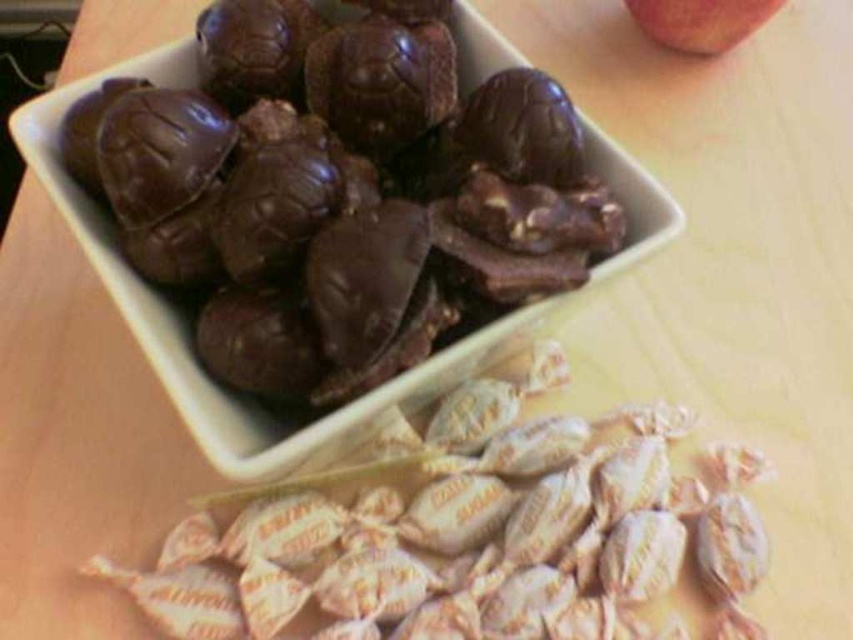
You are looking at the arrangement of candies and chocolate in the image. If you were to draw a straight line from your eye level to the point labeled point (527, 284) and then to the point labeled point (308, 531), which point would you encounter first?

You would encounter point (527, 284) first since it is closer to the viewer than point (308, 531).

You are a customer at a candy store and want to grab both the shiny chocolate candies at upper center and the white paper wrapped candy at lower center. Which one should you pick up first if you want to reach the one closer to your right hand?

The white paper wrapped candy at lower center is on the right side of the shiny chocolate candies at upper center, so you should pick up the white paper wrapped candy at lower center first if you want to reach the one closer to your right hand.

You are a food critic standing at the table where the shiny chocolate candies at upper center and the red matte apple at upper right are placed. You want to taste the item that is closer to you. Which one should you choose?

The shiny chocolate candies at upper center are closer to the viewer than the red matte apple at upper right, so you should choose the shiny chocolate candies at upper center to taste.